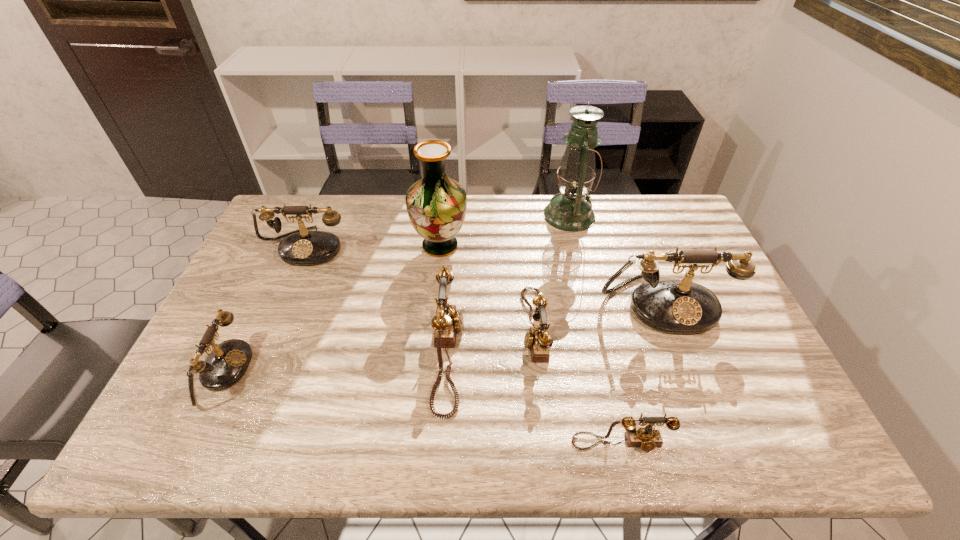
Locate an element on the screen. Image resolution: width=960 pixels, height=540 pixels. vacant space positioned 0.250m on the front-facing side of the second smallest brown telephone is located at coordinates (429, 327).

At what (x,y) coordinates should I click in order to perform the action: click on vacant space located on the dial of the smallest black telephone. Please return your answer as a coordinate pair (x, y). This screenshot has height=540, width=960. Looking at the image, I should click on (385, 372).

Where is `oil lamp at the far edge`? oil lamp at the far edge is located at coordinates (570, 210).

You are a GUI agent. You are given a task and a screenshot of the screen. Output one action in this format:
    pyautogui.click(x=<x>, y=<y>)
    Task: Click on the vase that is at the far edge
    This screenshot has height=540, width=960.
    Given the screenshot: What is the action you would take?
    pyautogui.click(x=436, y=204)

Identify the location of telephone located in the far edge section of the desktop. This screenshot has height=540, width=960. (300, 247).

This screenshot has height=540, width=960. In order to click on object that is at the right edge in this screenshot , I will do `click(675, 306)`.

Locate an element on the screen. object located at the far left corner is located at coordinates (300, 247).

Locate an element on the screen. This screenshot has height=540, width=960. blank space at the far edge of the desktop is located at coordinates (333, 202).

This screenshot has height=540, width=960. In the image, there is a desktop. Find the location of `vacant region at the near edge`. vacant region at the near edge is located at coordinates (601, 417).

I want to click on free space at the left edge of the desktop, so click(251, 363).